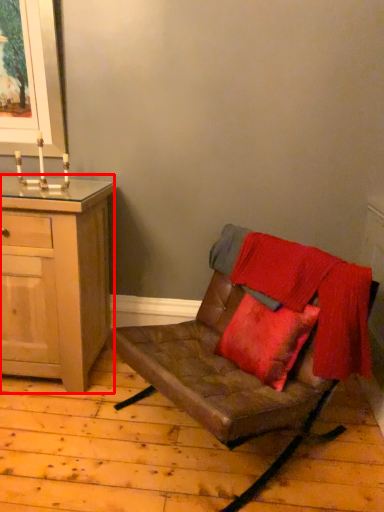
Question: Considering the relative positions of cabinetry (annotated by the red box) and chair in the image provided, where is cabinetry (annotated by the red box) located with respect to the staircase?

Choices:
 (A) left
 (B) right

Answer: (A)